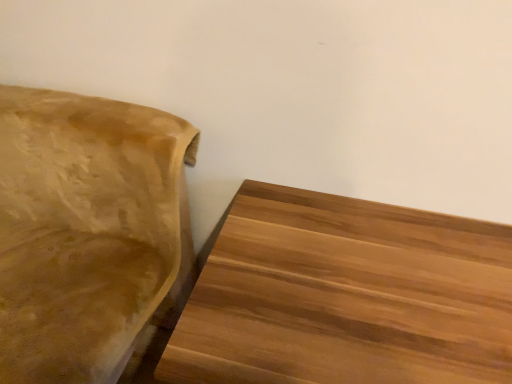
Locate an element on the screen. light brown wood table at lower right is located at coordinates (345, 296).

Image resolution: width=512 pixels, height=384 pixels. What do you see at coordinates (345, 296) in the screenshot?
I see `light brown wood table at lower right` at bounding box center [345, 296].

What is the approximate height of light brown wood table at lower right?

50.98 centimeters.

At what (x,y) coordinates should I click in order to perform the action: click on light brown wood table at lower right. Please return your answer as a coordinate pair (x, y). Looking at the image, I should click on (345, 296).